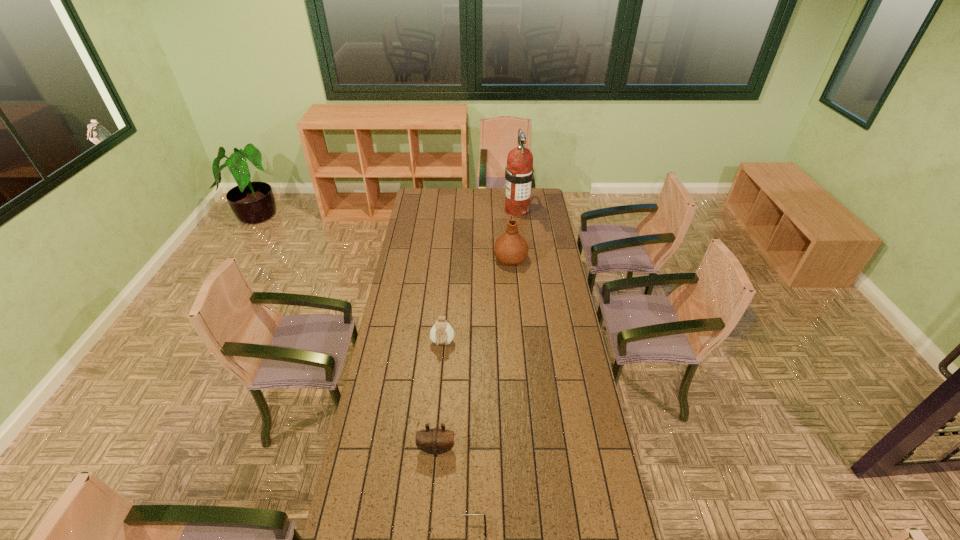
Where is `free region located on the side of the fourth shortest object with the handle`? free region located on the side of the fourth shortest object with the handle is located at coordinates (508, 225).

Image resolution: width=960 pixels, height=540 pixels. Identify the location of vacant space located 0.280m on the side of the fourth shortest object with the handle. (507, 220).

At what (x,y) coordinates should I click in order to perform the action: click on vacant space situated 0.250m on the front-facing side of the third shortest object. Please return your answer as a coordinate pair (x, y). Looking at the image, I should click on (438, 406).

You are a GUI agent. You are given a task and a screenshot of the screen. Output one action in this format:
    pyautogui.click(x=<x>, y=<y>)
    Task: Click on the vacant space located with the flap open on the second nearest object
    The width and height of the screenshot is (960, 540).
    Given the screenshot: What is the action you would take?
    pyautogui.click(x=430, y=524)

Identify the location of object that is positioned at the far edge. The width and height of the screenshot is (960, 540). (519, 172).

Where is `object located in the right edge section of the desktop`? The image size is (960, 540). object located in the right edge section of the desktop is located at coordinates (519, 172).

Identify the location of object that is at the far right corner. (519, 172).

The image size is (960, 540). What are the coordinates of `vacant space at the far edge` in the screenshot? It's located at (483, 197).

You are a GUI agent. You are given a task and a screenshot of the screen. Output one action in this format:
    pyautogui.click(x=<x>, y=<y>)
    Task: Click on the free space at the left edge of the desktop
    The width and height of the screenshot is (960, 540).
    Given the screenshot: What is the action you would take?
    pyautogui.click(x=390, y=498)

The width and height of the screenshot is (960, 540). I want to click on vacant space at the right edge of the desktop, so click(x=529, y=232).